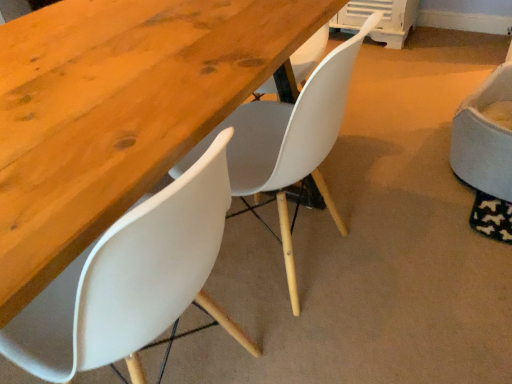
Question: Considering the positions of wooden table at center and white plastic chair at lower left, the first chair positioned from the left, in the image, is wooden table at center taller or shorter than white plastic chair at lower left, the first chair positioned from the left,?

Choices:
 (A) short
 (B) tall

Answer: (A)

Question: Is wooden table at center spatially inside white plastic chair at lower left, the first chair positioned from the left, or outside of it?

Choices:
 (A) inside
 (B) outside

Answer: (B)

Question: Which object is the farthest from the white fabric chair at right, which is the 3th chair from left to right?

Choices:
 (A) wooden table at center
 (B) white matte chair at center, which ranks as the second chair in right-to-left order
 (C) white plastic chair at lower left, the first chair positioned from the left

Answer: (C)

Question: Which of these objects is positioned closest to the wooden table at center?

Choices:
 (A) white fabric chair at right, which is the 3th chair from left to right
 (B) white plastic chair at lower left, the first chair positioned from the left
 (C) white matte chair at center, which ranks as the second chair in right-to-left order

Answer: (B)